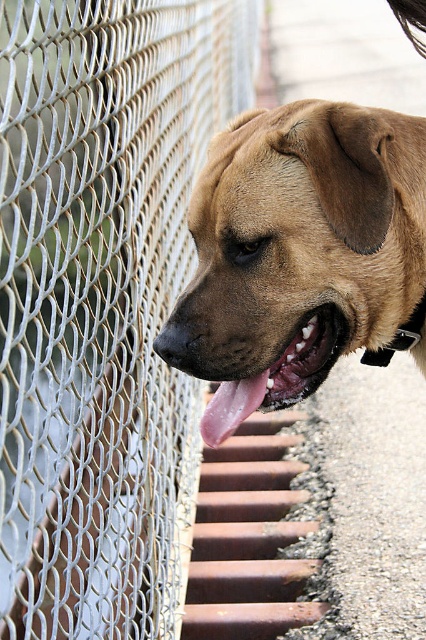
You are standing in front of the dog and want to know where the silver mesh fence at left is located. Can you tell me its exact coordinates?

The silver mesh fence at left is located at coordinates point (103, 301).

You are a photographer holding a camera that requires you to be at least 40 inches away from the subject to focus properly. You want to take a photo of the silver mesh fence at left. Can you focus on it with your current position?

The silver mesh fence at left is only 35.36 inches away from the viewer, which is less than the 40 inches required for proper focus. Move back to increase the distance.